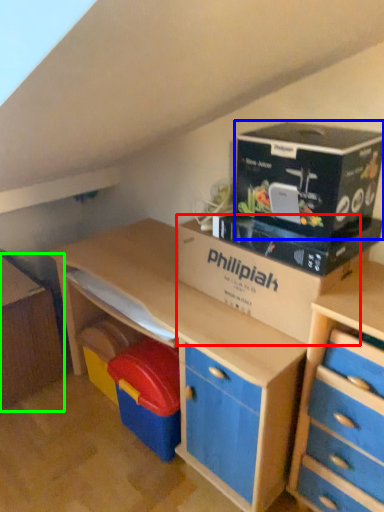
Question: Estimate the real-world distances between objects in this image. Which object is closer to cardboard box (highlighted by a red box), cardboard (highlighted by a blue box) or file cabinet (highlighted by a green box)?

Choices:
 (A) cardboard
 (B) file cabinet

Answer: (A)